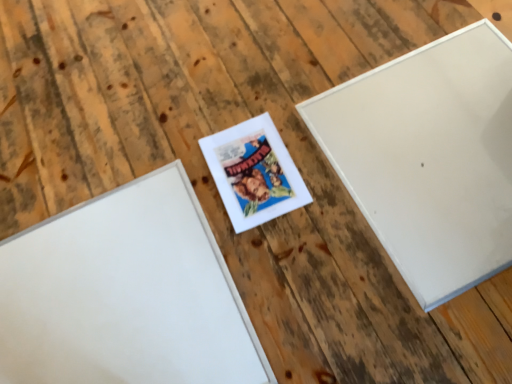
The height and width of the screenshot is (384, 512). Find the location of `vacant space to the right of matte white picture frame at center, positioned as the second picture frame in right-to-left order`. vacant space to the right of matte white picture frame at center, positioned as the second picture frame in right-to-left order is located at coordinates (338, 149).